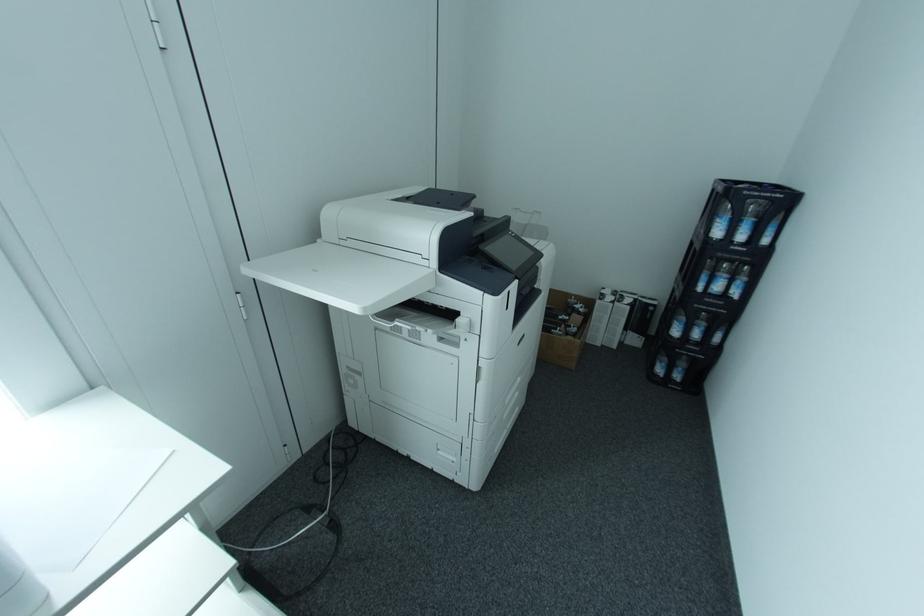
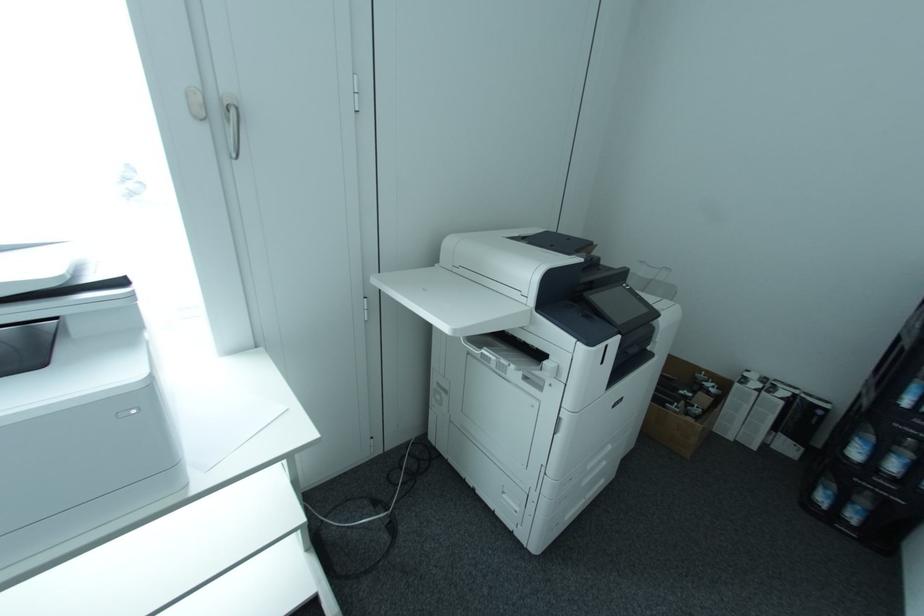
Question: The camera is either moving clockwise (left) or counter-clockwise (right) around the object. The first image is from the beginning of the video and the second image is from the end. Is the camera moving left or right when shooting the video?

Choices:
 (A) Left
 (B) Right

Answer: (B)